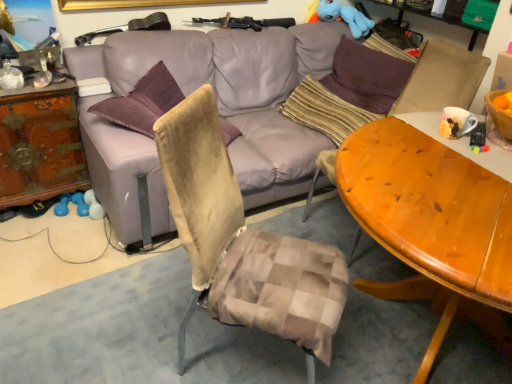
Question: Is brown fabric swivel chair at right smaller than wooden table at center?

Choices:
 (A) yes
 (B) no

Answer: (A)

Question: Is brown fabric swivel chair at right turned away from wooden table at center?

Choices:
 (A) yes
 (B) no

Answer: (B)

Question: Is brown fabric swivel chair at right taller than wooden table at center?

Choices:
 (A) yes
 (B) no

Answer: (B)

Question: Considering the relative sizes of brown fabric swivel chair at right and wooden table at center in the image provided, is brown fabric swivel chair at right bigger than wooden table at center?

Choices:
 (A) yes
 (B) no

Answer: (B)

Question: From a real-world perspective, is brown fabric swivel chair at right positioned under wooden table at center based on gravity?

Choices:
 (A) no
 (B) yes

Answer: (A)

Question: From a real-world perspective, is brown fabric swivel chair at right physically located above or below purple fabric pillow at upper right, which appears as the first pillow when viewed from the right?

Choices:
 (A) above
 (B) below

Answer: (B)

Question: From the image's perspective, relative to purple fabric pillow at upper right, which is the second pillow from left to right, is brown fabric swivel chair at right above or below?

Choices:
 (A) below
 (B) above

Answer: (A)

Question: Is point (456, 69) positioned closer to the camera than point (393, 94)?

Choices:
 (A) farther
 (B) closer

Answer: (B)

Question: Looking at their shapes, would you say brown fabric swivel chair at right is wider or thinner than purple fabric pillow at upper right, which is the second pillow from left to right?

Choices:
 (A) wide
 (B) thin

Answer: (A)

Question: Which is correct: blue plush toy at upper right is inside wooden table at center, or outside of it?

Choices:
 (A) outside
 (B) inside

Answer: (A)

Question: In terms of height, does blue plush toy at upper right look taller or shorter compared to wooden table at center?

Choices:
 (A) tall
 (B) short

Answer: (B)

Question: Is blue plush toy at upper right bigger or smaller than wooden table at center?

Choices:
 (A) small
 (B) big

Answer: (A)

Question: Is point (353, 23) closer or farther from the camera than point (397, 206)?

Choices:
 (A) closer
 (B) farther

Answer: (B)

Question: Based on their positions, is wooden carved dresser at left located to the left or right of striped fabric pillow at center, which is the second pillow from right to left?

Choices:
 (A) left
 (B) right

Answer: (A)

Question: In terms of height, does wooden carved dresser at left look taller or shorter compared to striped fabric pillow at center, which is the second pillow from right to left?

Choices:
 (A) short
 (B) tall

Answer: (B)